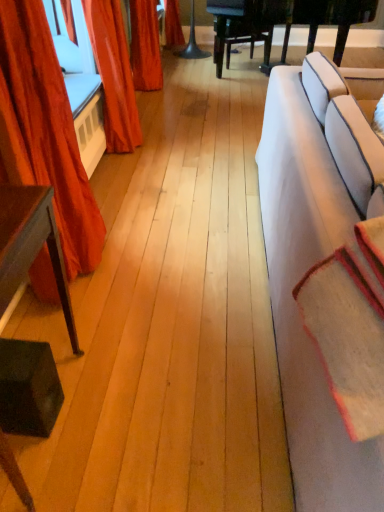
Where is `spots to the right of velvet red curtain at left, the 1th curtain viewed from the front`? The height and width of the screenshot is (512, 384). spots to the right of velvet red curtain at left, the 1th curtain viewed from the front is located at coordinates (152, 264).